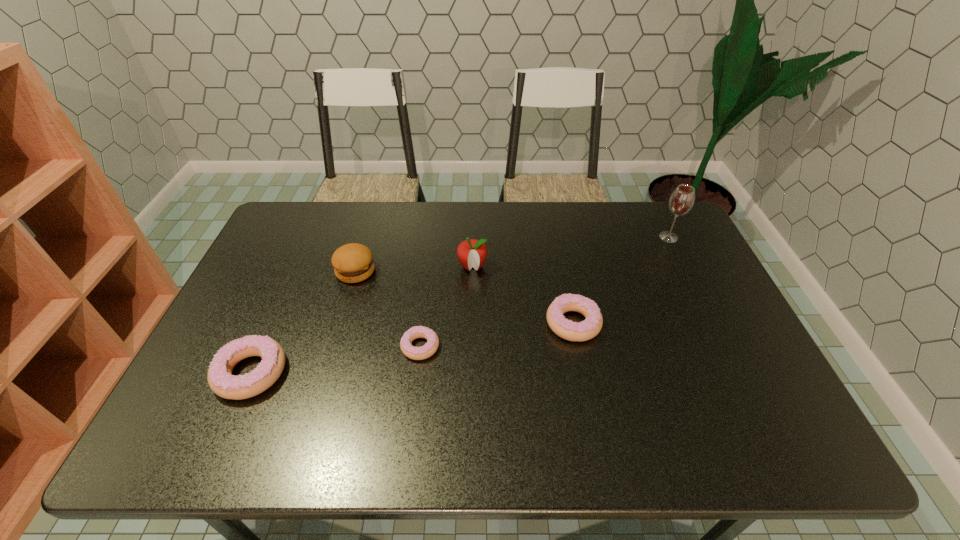
Where is `the farthest object`? The height and width of the screenshot is (540, 960). the farthest object is located at coordinates (681, 201).

I want to click on vacant area located 0.210m on the right of the leftmost doughnut, so click(x=372, y=372).

Where is `free space located on the right of the shortest doughnut`? Image resolution: width=960 pixels, height=540 pixels. free space located on the right of the shortest doughnut is located at coordinates (459, 346).

Locate an element on the screen. This screenshot has width=960, height=540. vacant area situated 0.300m on the right of the fifth object from left to right is located at coordinates (710, 323).

You are a GUI agent. You are given a task and a screenshot of the screen. Output one action in this format:
    pyautogui.click(x=<x>, y=<y>)
    Task: Click on the free region located 0.170m on the front of the fifth object from right to left
    Image resolution: width=960 pixels, height=540 pixels.
    Given the screenshot: What is the action you would take?
    pyautogui.click(x=338, y=329)

Locate an element on the screen. Image resolution: width=960 pixels, height=540 pixels. vacant space located 0.310m on the right of the second tallest object is located at coordinates (588, 266).

You are a GUI agent. You are given a task and a screenshot of the screen. Output one action in this format:
    pyautogui.click(x=<x>, y=<y>)
    Task: Click on the vacant area situated on the back of the farthest object
    This screenshot has width=960, height=540.
    Given the screenshot: What is the action you would take?
    pyautogui.click(x=655, y=208)

At what (x,y) coordinates should I click in order to perform the action: click on object situated at the far edge. Please return your answer as a coordinate pair (x, y). Looking at the image, I should click on (681, 201).

Locate an element on the screen. This screenshot has width=960, height=540. object that is at the near edge is located at coordinates (220, 379).

You are a GUI agent. You are given a task and a screenshot of the screen. Output one action in this format:
    pyautogui.click(x=<x>, y=<y>)
    Task: Click on the object that is at the left edge
    The width and height of the screenshot is (960, 540).
    Given the screenshot: What is the action you would take?
    pyautogui.click(x=220, y=379)